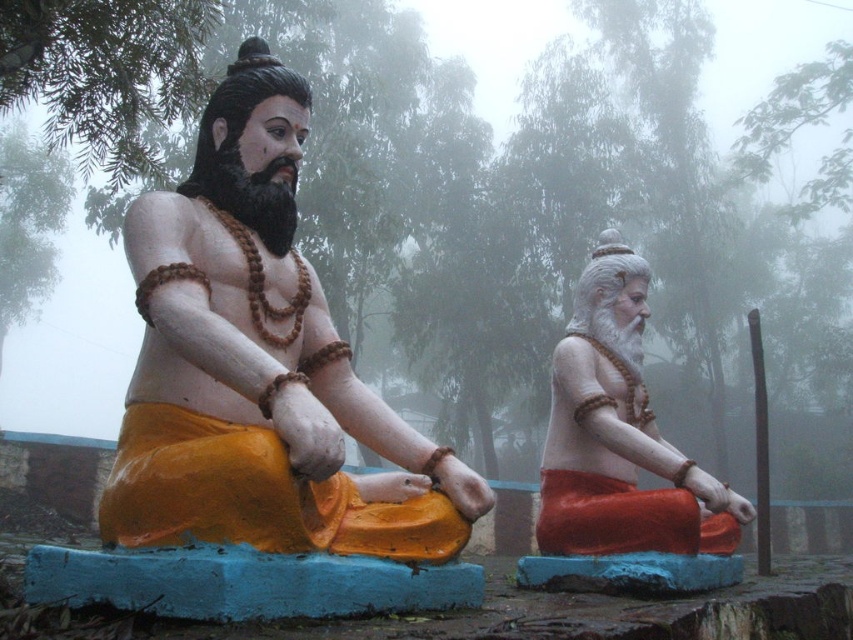
You are a visitor at a temple and want to take a photo of both the matte orange statue at center and the matte orange statue at right. Since you have a limited zoom range, you need to know which statue is taller to frame your shot properly. Which statue should you focus on first to ensure it fits in the frame?

The matte orange statue at center is much taller than the matte orange statue at right, so you should focus on the matte orange statue at center first to ensure it fits in the frame.